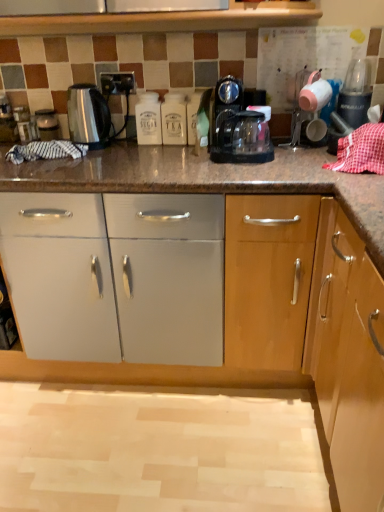
I want to click on satin silver kettle at left, so click(x=87, y=114).

Where is `metallic socket at upper center`? The width and height of the screenshot is (384, 512). metallic socket at upper center is located at coordinates (117, 83).

I want to click on white plastic tea container at center, the 2th bottle positioned from the left, so click(x=174, y=119).

Between transparent plastic coffee maker at center and satin silver kettle at left, which one is positioned behind?

satin silver kettle at left is more distant.

Consider the image. Would you say transparent plastic coffee maker at center is to the left or to the right of satin silver kettle at left in the picture?

transparent plastic coffee maker at center is to the right of satin silver kettle at left.

Which object is thinner, transparent plastic coffee maker at center or satin silver kettle at left?

With smaller width is satin silver kettle at left.

In the scene shown: From a real-world perspective, which is physically above, white matte sugar container at center, positioned as the 2th bottle in right-to-left order, or transparent plastic coffee maker at center?

transparent plastic coffee maker at center is physically above.

Is white matte sugar container at center, positioned as the 2th bottle in right-to-left order, inside or outside of transparent plastic coffee maker at center?

white matte sugar container at center, positioned as the 2th bottle in right-to-left order, is not inside transparent plastic coffee maker at center, it's outside.

Looking at this image, can you confirm if white matte sugar container at center, positioned as the 2th bottle in right-to-left order, is positioned to the right of transparent plastic coffee maker at center?

No.

Does white matte sugar container at center, positioned as the 2th bottle in right-to-left order, have a greater width compared to transparent plastic coffee maker at center?

No.

From a real-world perspective, is white plastic tea container at center, the 2th bottle positioned from the left, physically above metallic socket at upper center?

Incorrect, from a real-world perspective, white plastic tea container at center, the 2th bottle positioned from the left, is lower than metallic socket at upper center.

Between white plastic tea container at center, the 2th bottle positioned from the left, and metallic socket at upper center, which one has more height?

Standing taller between the two is white plastic tea container at center, the 2th bottle positioned from the left.

Which is behind, point (171, 140) or point (128, 91)?

The point (171, 140) is farther from the camera.

In order to click on electric outlet above the white plastic tea container at center, which ranks as the first bottle in right-to-left order (from the image's perspective) in this screenshot , I will do `click(117, 83)`.

From the image's perspective, does transparent plastic coffee maker at center appear lower than metallic socket at upper center?

Yes, from the image's perspective, transparent plastic coffee maker at center is below metallic socket at upper center.

Considering the relative sizes of transparent plastic coffee maker at center and metallic socket at upper center in the image provided, is transparent plastic coffee maker at center wider than metallic socket at upper center?

Yes.

Identify the location of electric outlet that appears above the transparent plastic coffee maker at center (from a real-world perspective). (117, 83).

Is there a large distance between transparent plastic coffee maker at center and metallic socket at upper center?

No, transparent plastic coffee maker at center is not far away from metallic socket at upper center.

Measure the distance from white matte sugar container at center, positioned as the 2th bottle in right-to-left order, to white plastic tea container at center, which ranks as the first bottle in right-to-left order.

They are 2.34 inches apart.

Is white matte sugar container at center, positioned as the 2th bottle in right-to-left order, thinner than white plastic tea container at center, the 2th bottle positioned from the left?

Correct, the width of white matte sugar container at center, positioned as the 2th bottle in right-to-left order, is less than that of white plastic tea container at center, the 2th bottle positioned from the left.

Is point (154, 142) behind point (161, 108)?

Yes.

In the scene shown: Can white plastic tea container at center, which ranks as the first bottle in right-to-left order, be found inside white matte sugar container at center, positioned as the 2th bottle in right-to-left order?

No, white plastic tea container at center, which ranks as the first bottle in right-to-left order, is not a part of white matte sugar container at center, positioned as the 2th bottle in right-to-left order.

Between point (47, 129) and point (155, 99), which one is positioned behind?

The point (47, 129) is farther.

Are satin silver kettle at left and white matte sugar container at center, positioned as the 2th bottle in right-to-left order, beside each other?

satin silver kettle at left is not next to white matte sugar container at center, positioned as the 2th bottle in right-to-left order, and they're not touching.

From a real-world perspective, is satin silver kettle at left physically located above or below white matte sugar container at center, positioned as the 2th bottle in right-to-left order?

Clearly, from a real-world perspective, satin silver kettle at left is below white matte sugar container at center, positioned as the 2th bottle in right-to-left order.

Can you tell me how much satin silver kettle at left and white matte sugar container at center, positioned as the 1th bottle in left-to-right order, differ in facing direction?

They differ by 2.1 degrees in their facing directions.

Which object is positioned more to the right, metallic socket at upper center or transparent plastic coffee maker at center?

transparent plastic coffee maker at center.

From the image's perspective, is metallic socket at upper center located above transparent plastic coffee maker at center?

Yes.

Can you confirm if metallic socket at upper center is wider than transparent plastic coffee maker at center?

In fact, metallic socket at upper center might be narrower than transparent plastic coffee maker at center.

Considering the relative sizes of metallic socket at upper center and transparent plastic coffee maker at center in the image provided, is metallic socket at upper center smaller than transparent plastic coffee maker at center?

Yes, metallic socket at upper center is smaller than transparent plastic coffee maker at center.

Where is `kitchen appliance to the left of transparent plastic coffee maker at center`? Image resolution: width=384 pixels, height=512 pixels. kitchen appliance to the left of transparent plastic coffee maker at center is located at coordinates (87, 114).

Locate an element on the screen. This screenshot has height=512, width=384. home appliance located above the white matte sugar container at center, positioned as the 1th bottle in left-to-right order (from a real-world perspective) is located at coordinates (238, 127).

Considering their positions, is white plastic tea container at center, the 2th bottle positioned from the left, positioned further to satin silver kettle at left than white matte sugar container at center, positioned as the 2th bottle in right-to-left order?

Based on the image, white plastic tea container at center, the 2th bottle positioned from the left, appears to be further to satin silver kettle at left.

Looking at the image, which one is located further to satin silver kettle at left, satin silver kettle at left or metallic socket at upper center?

metallic socket at upper center is further to satin silver kettle at left.

From the picture: From the image, which object appears to be nearer to metallic socket at upper center, transparent plastic coffee maker at center or satin silver kettle at left?

satin silver kettle at left lies closer to metallic socket at upper center than the other object.

In the scene shown: Based on their spatial positions, is satin silver kettle at left or white matte sugar container at center, positioned as the 2th bottle in right-to-left order, closer to transparent plastic coffee maker at center?

white matte sugar container at center, positioned as the 2th bottle in right-to-left order, lies closer to transparent plastic coffee maker at center than the other object.

Estimate the real-world distances between objects in this image. Which object is further from satin silver kettle at left, white matte sugar container at center, positioned as the 1th bottle in left-to-right order, or satin silver kettle at left?

satin silver kettle at left is positioned further to the anchor satin silver kettle at left.

Which object lies nearer to the anchor point metallic socket at upper center, white matte sugar container at center, positioned as the 1th bottle in left-to-right order, or satin silver kettle at left?

white matte sugar container at center, positioned as the 1th bottle in left-to-right order, is closer to metallic socket at upper center.

In the scene shown: Based on their spatial positions, is satin silver kettle at left or white plastic tea container at center, the 2th bottle positioned from the left, closer to transparent plastic coffee maker at center?

Among the two, white plastic tea container at center, the 2th bottle positioned from the left, is located nearer to transparent plastic coffee maker at center.

From the image, which object appears to be nearer to satin silver kettle at left, transparent plastic coffee maker at center or metallic socket at upper center?

metallic socket at upper center.

Find the location of a particular element. The height and width of the screenshot is (512, 384). electric outlet between satin silver kettle at left and transparent plastic coffee maker at center is located at coordinates (117, 83).

Where is `electric outlet between satin silver kettle at left and white matte sugar container at center, positioned as the 1th bottle in left-to-right order`? Image resolution: width=384 pixels, height=512 pixels. electric outlet between satin silver kettle at left and white matte sugar container at center, positioned as the 1th bottle in left-to-right order is located at coordinates (117, 83).

At what (x,y) coordinates should I click in order to perform the action: click on kitchen appliance between satin silver kettle at left and metallic socket at upper center. Please return your answer as a coordinate pair (x, y). This screenshot has height=512, width=384. Looking at the image, I should click on (87, 114).

The height and width of the screenshot is (512, 384). Find the location of `electric outlet situated between satin silver kettle at left and white matte sugar container at center, positioned as the 2th bottle in right-to-left order, from left to right`. electric outlet situated between satin silver kettle at left and white matte sugar container at center, positioned as the 2th bottle in right-to-left order, from left to right is located at coordinates (117, 83).